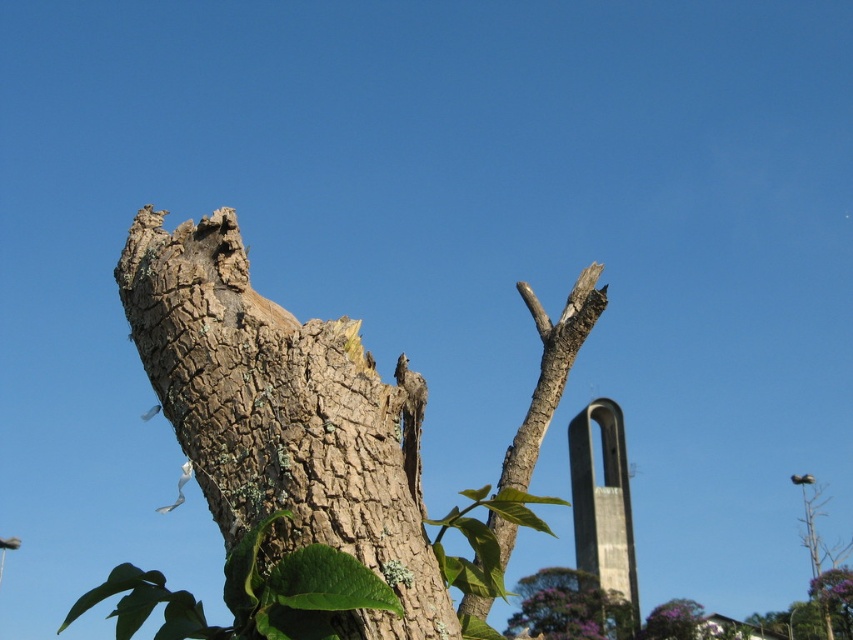
Can you confirm if brown rough bark at center is bigger than brown rough bark branch at upper center?

No.

Is brown rough bark at center above brown rough bark branch at upper center?

Indeed, brown rough bark at center is positioned over brown rough bark branch at upper center.

This screenshot has height=640, width=853. What do you see at coordinates (283, 417) in the screenshot? I see `brown rough bark at center` at bounding box center [283, 417].

You are a GUI agent. You are given a task and a screenshot of the screen. Output one action in this format:
    pyautogui.click(x=<x>, y=<y>)
    Task: Click on the brown rough bark at center
    
    Given the screenshot: What is the action you would take?
    pyautogui.click(x=283, y=417)

Based on the photo, between brown rough bark at center and purple leafy tree at lower right, which one appears on the left side from the viewer's perspective?

From the viewer's perspective, brown rough bark at center appears more on the left side.

Between point (212, 404) and point (662, 604), which one is positioned behind?

The point (662, 604) is more distant.

At what (x,y) coordinates should I click in order to perform the action: click on brown rough bark at center. Please return your answer as a coordinate pair (x, y). The height and width of the screenshot is (640, 853). Looking at the image, I should click on (283, 417).

Is brown rough bark at center to the right of smooth gray tree trunk at center from the viewer's perspective?

In fact, brown rough bark at center is to the left of smooth gray tree trunk at center.

Between point (299, 380) and point (587, 596), which one is positioned behind?

The point (587, 596) is more distant.

The image size is (853, 640). I want to click on brown rough bark at center, so click(283, 417).